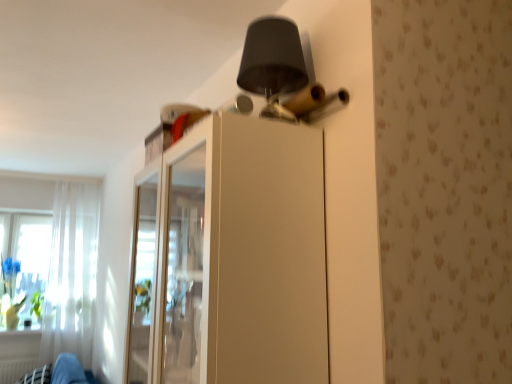
Question: Does white sheer curtain at left appear on the right side of white glossy cabinet at upper center?

Choices:
 (A) yes
 (B) no

Answer: (B)

Question: From the image's perspective, does white sheer curtain at left appear lower than white glossy cabinet at upper center?

Choices:
 (A) no
 (B) yes

Answer: (B)

Question: From the image's perspective, would you say white sheer curtain at left is positioned over white glossy cabinet at upper center?

Choices:
 (A) no
 (B) yes

Answer: (A)

Question: Is white glossy cabinet at upper center surrounded by white sheer curtain at left?

Choices:
 (A) no
 (B) yes

Answer: (A)

Question: Is white sheer curtain at left outside white glossy cabinet at upper center?

Choices:
 (A) yes
 (B) no

Answer: (A)

Question: Do you think white sheer curtain at left is within white glossy cabinet at upper center, or outside of it?

Choices:
 (A) outside
 (B) inside

Answer: (A)

Question: Based on their sizes in the image, would you say white sheer curtain at left is bigger or smaller than white glossy cabinet at upper center?

Choices:
 (A) small
 (B) big

Answer: (A)

Question: From a real-world perspective, is white sheer curtain at left physically located above or below white glossy cabinet at upper center?

Choices:
 (A) below
 (B) above

Answer: (A)

Question: Is white sheer curtain at left to the left or to the right of white glossy cabinet at upper center in the image?

Choices:
 (A) right
 (B) left

Answer: (B)

Question: Is point (62, 284) closer or farther from the camera than point (55, 362)?

Choices:
 (A) closer
 (B) farther

Answer: (B)

Question: Do you think white sheer curtain at left is within black fabric swivel chair at lower left, or outside of it?

Choices:
 (A) outside
 (B) inside

Answer: (A)

Question: From the image's perspective, relative to black fabric swivel chair at lower left, is white sheer curtain at left above or below?

Choices:
 (A) below
 (B) above

Answer: (B)

Question: Visually, is white sheer curtain at left positioned to the left or to the right of black fabric swivel chair at lower left?

Choices:
 (A) right
 (B) left

Answer: (B)

Question: From the image's perspective, relative to white sheer curtain at left, is white glossy cabinet at upper center above or below?

Choices:
 (A) below
 (B) above

Answer: (B)

Question: Relative to white sheer curtain at left, is white glossy cabinet at upper center in front or behind?

Choices:
 (A) front
 (B) behind

Answer: (A)